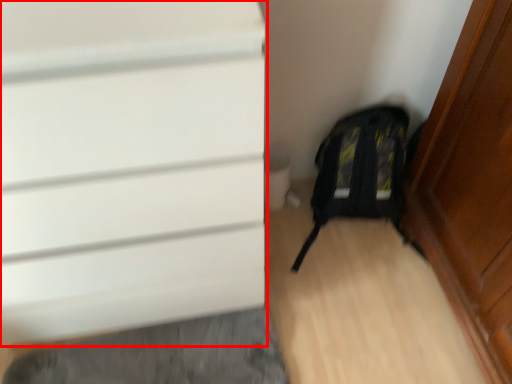
Question: Observing the image, what is the correct spatial positioning of door (annotated by the red box) in reference to backpack?

Choices:
 (A) right
 (B) left

Answer: (B)